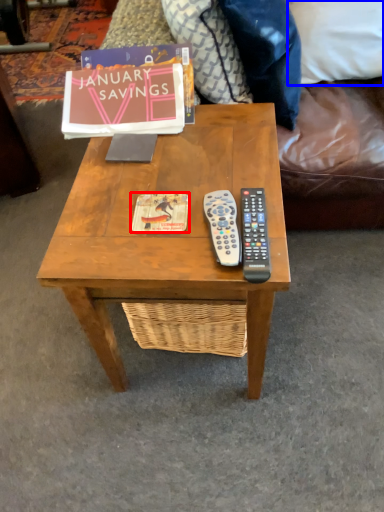
Question: Which object appears closest to the camera in this image, book cover (highlighted by a red box) or pillow (highlighted by a blue box)?

Choices:
 (A) book cover
 (B) pillow

Answer: (A)